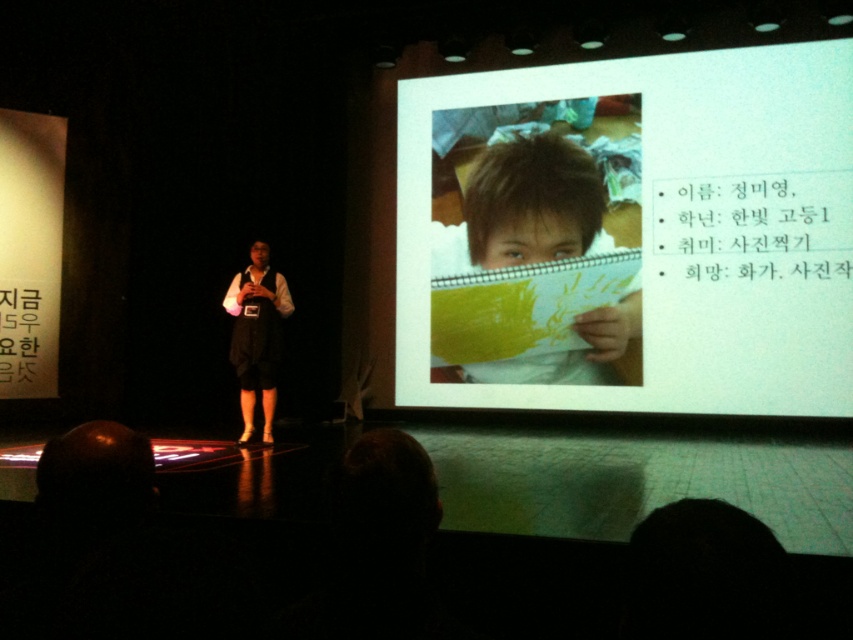
Which of these two, matte paper at upper center or white fabric shirt at center, stands taller?

matte paper at upper center is taller.

Identify the location of matte paper at upper center. (634, 230).

Is point (671, 253) farther from camera compared to point (567, 368)?

No, (671, 253) is in front of (567, 368).

Who is positioned more to the left, matte paper at upper center or matte yellow paper at center?

Positioned to the left is matte yellow paper at center.

Find the location of `matte paper at upper center`. matte paper at upper center is located at coordinates (634, 230).

Identify the location of matte paper at upper center. (634, 230).

Measure the distance from matte yellow paper at center to white fabric shirt at center.

The distance of matte yellow paper at center from white fabric shirt at center is 2.59 meters.

Can you confirm if matte yellow paper at center is positioned to the left of white fabric shirt at center?

In fact, matte yellow paper at center is to the right of white fabric shirt at center.

This screenshot has width=853, height=640. What do you see at coordinates (532, 204) in the screenshot? I see `matte yellow paper at center` at bounding box center [532, 204].

Where is `matte yellow paper at center`? The width and height of the screenshot is (853, 640). matte yellow paper at center is located at coordinates (532, 204).